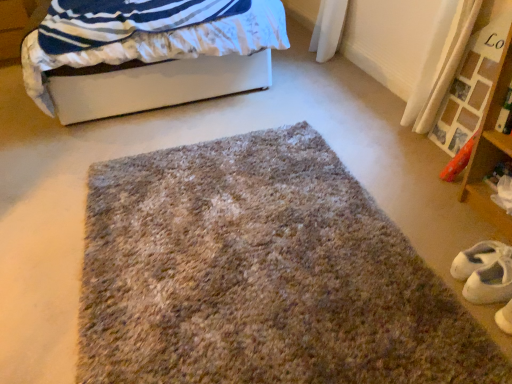
This screenshot has height=384, width=512. I want to click on vacant area that lies between white smooth bed at upper left and fuzzy carpet at center, so click(137, 153).